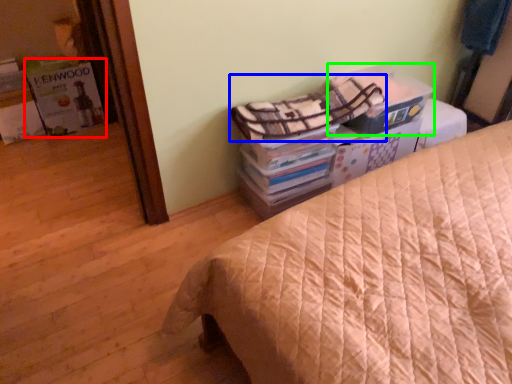
Question: Considering the real-world distances, which object is closest to magazine (highlighted by a red box)? blanket (highlighted by a blue box) or cardboard box (highlighted by a green box).

Choices:
 (A) blanket
 (B) cardboard box

Answer: (A)